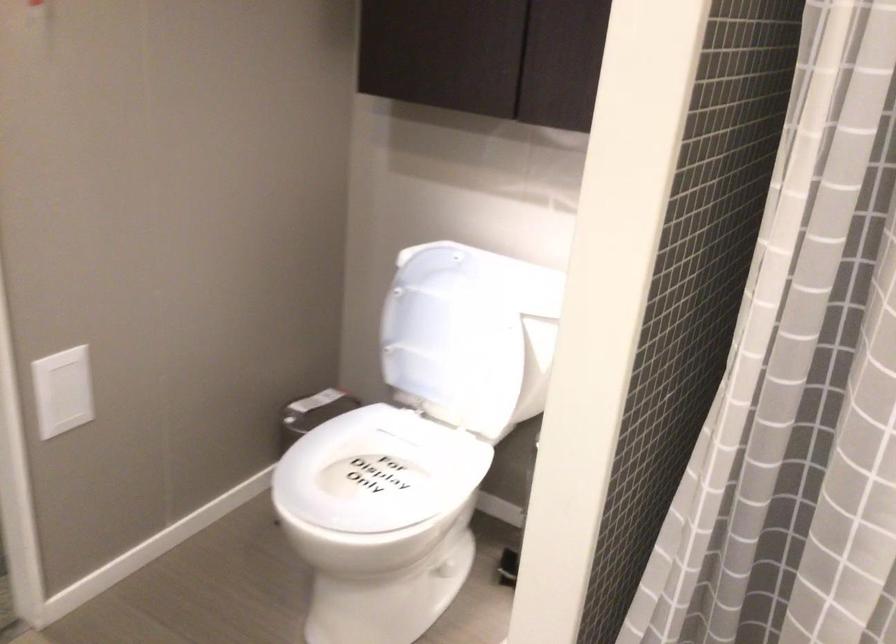
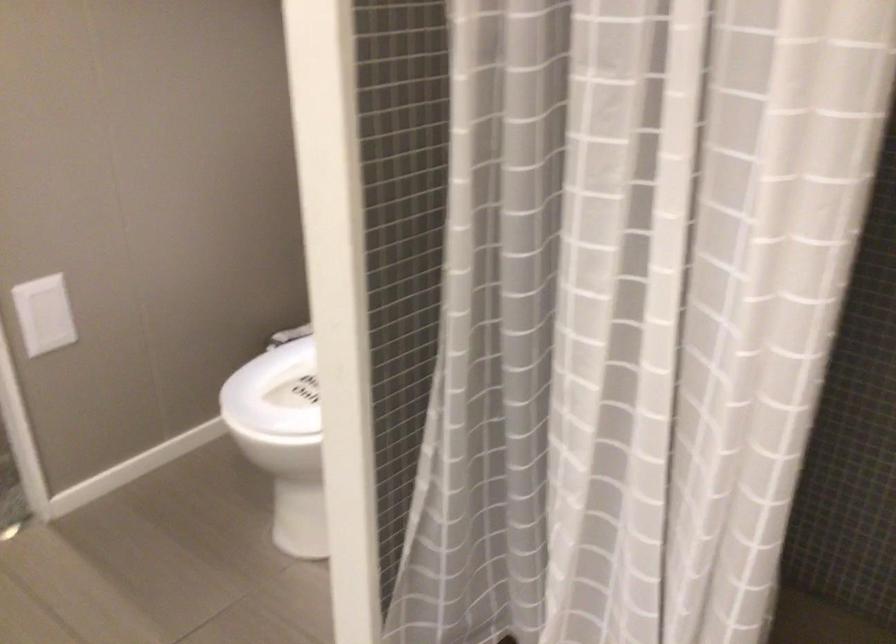
Question: In a continuous first-person perspective shot, in which direction is the camera moving?

Choices:
 (A) Left
 (B) Right
 (C) Forward
 (D) Backward

Answer: (B)